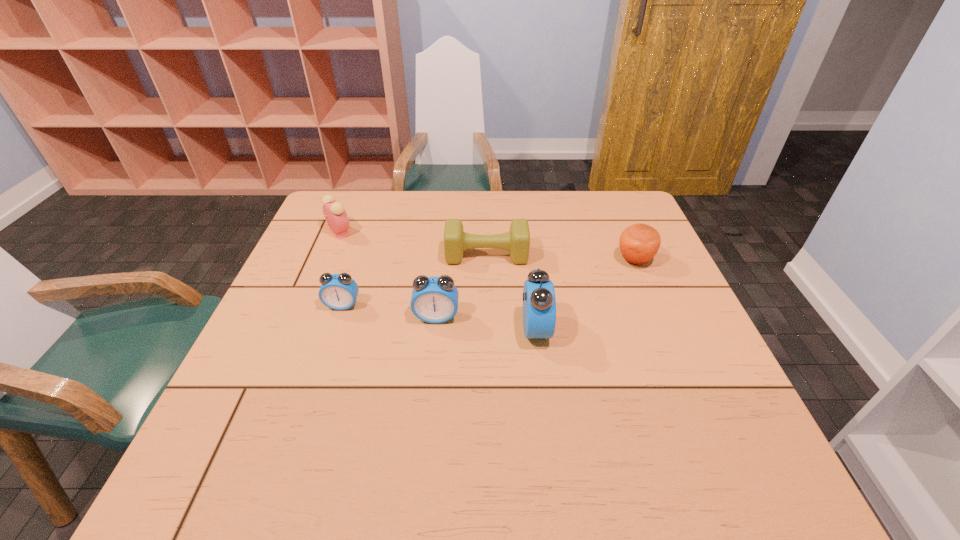
Considering the uniform spacing of alarm clocks, where should an additional alarm clock be positioned on the right? Please locate a free spot. Please provide its 2D coordinates. Your answer should be formatted as a tuple, i.e. [(x, y)], where the tuple contains the x and y coordinates of a point satisfying the conditions above.

[(640, 342)]